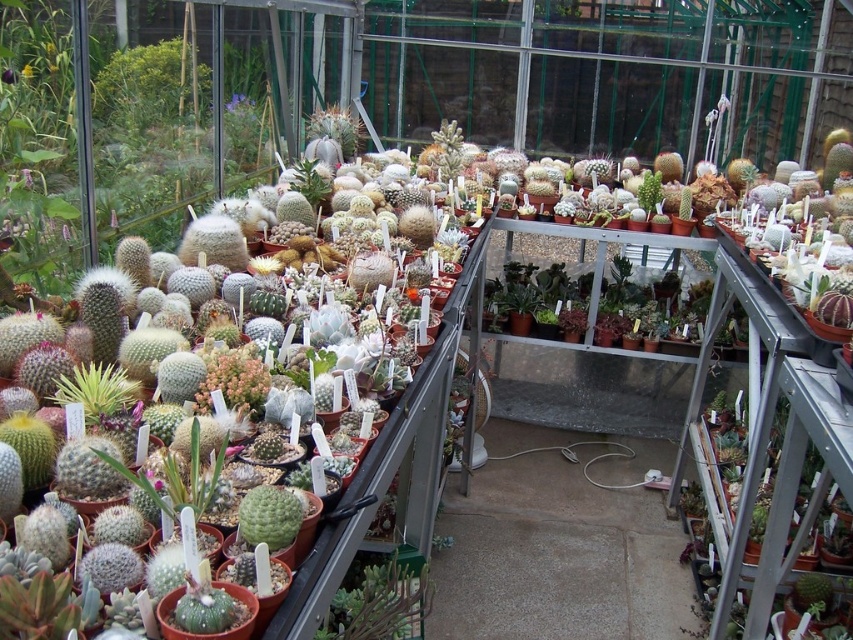
Does green matte cactus at lower center appear on the right side of green fuzzy cactus at center?

Yes, green matte cactus at lower center is to the right of green fuzzy cactus at center.

Who is lower down, green matte cactus at lower center or green fuzzy cactus at center?

Positioned lower is green matte cactus at lower center.

At what (x,y) coordinates should I click in order to perform the action: click on green matte cactus at lower center. Please return your answer as a coordinate pair (x, y). Image resolution: width=853 pixels, height=640 pixels. Looking at the image, I should click on (380, 604).

Can you confirm if green fuzzy cactus at left is positioned to the left of green fuzzy cactus at center?

Yes, green fuzzy cactus at left is to the left of green fuzzy cactus at center.

Identify the location of green fuzzy cactus at left. This screenshot has height=640, width=853. (97, 390).

Is point (86, 397) positioned behind point (344, 115)?

No, (86, 397) is closer to viewer.

I want to click on green fuzzy cactus at left, so click(97, 390).

Can you confirm if green matte cactus at lower center is positioned above green fuzzy cactus at left?

No.

Is point (419, 588) closer to viewer compared to point (97, 410)?

No, it is not.

This screenshot has width=853, height=640. Describe the element at coordinates (380, 604) in the screenshot. I see `green matte cactus at lower center` at that location.

Find the location of a particular element. The image size is (853, 640). green matte cactus at lower center is located at coordinates (380, 604).